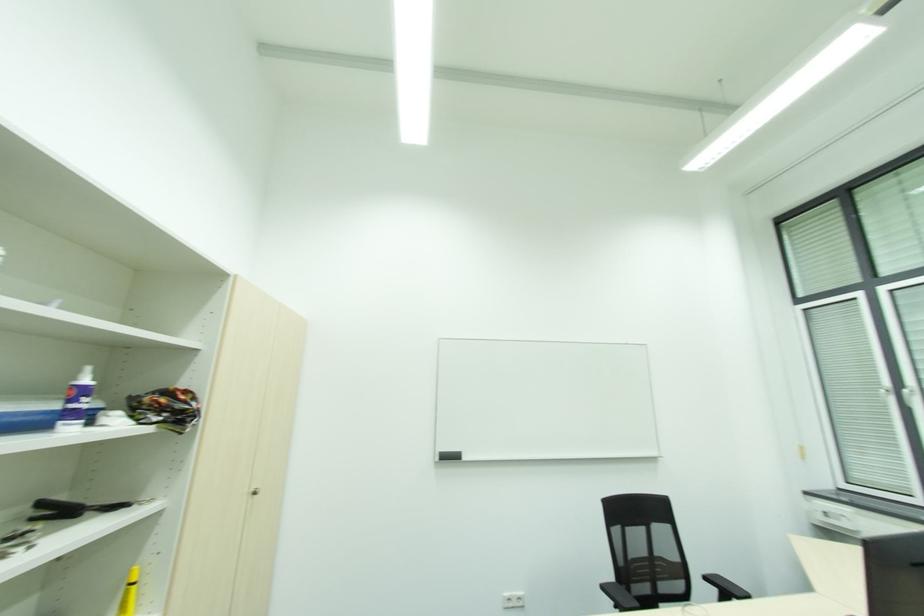
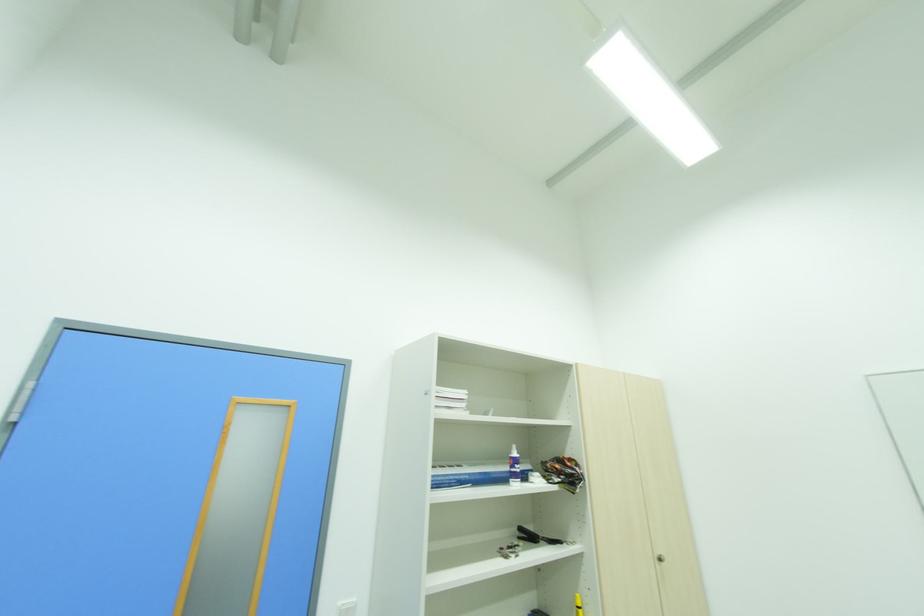
Locate, in the second image, the point that corresponds to (89,381) in the first image.

(517, 455)